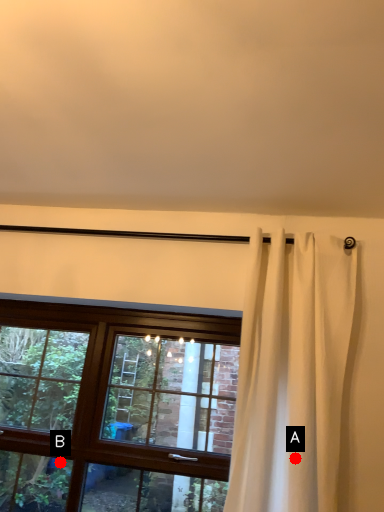
Question: Two points are circled on the image, labeled by A and B beside each circle. Which point is closer to the camera taking this photo?

Choices:
 (A) A is closer
 (B) B is closer

Answer: (A)